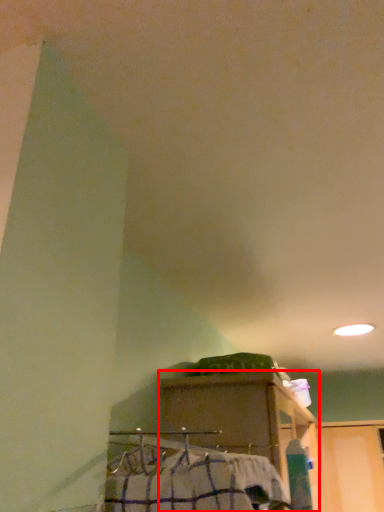
Question: Where is furniture (annotated by the red box) located in relation to job in the image?

Choices:
 (A) left
 (B) right

Answer: (B)